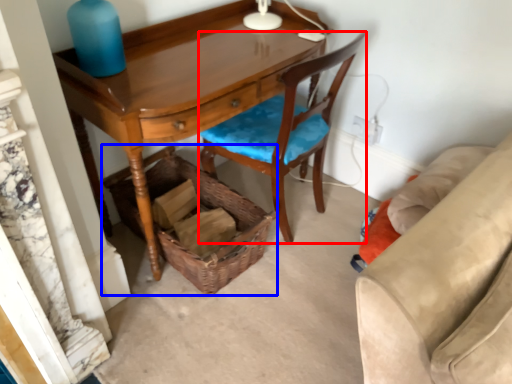
Question: Which object is closer to the camera taking this photo, chair (highlighted by a red box) or picnic basket (highlighted by a blue box)?

Choices:
 (A) chair
 (B) picnic basket

Answer: (A)